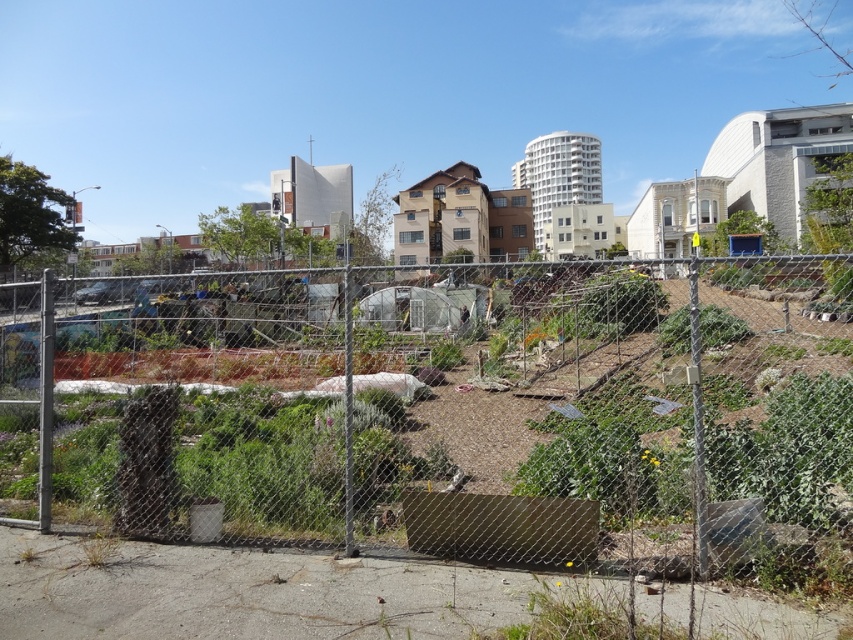
You are a city planner assessing the urban garden space. You need to determine if the green leafy plant at center can be moved closer to the metal mesh fence at center without obstructing the fence. Based on their sizes, is this feasible?

The metal mesh fence at center is larger than the green leafy plant at center, so moving the plant closer would not obstruct the fence as the fence is bigger in size.

You are a gardener who wants to install a new plant bed between the metal mesh fence at center and the green leafy plant at center. Given their widths, which object should you place closer to the narrower side to ensure proper spacing?

The metal mesh fence at center is wider than the green leafy plant at center. Therefore, you should place the narrower green leafy plant at center closer to the narrower side to maintain proper spacing.